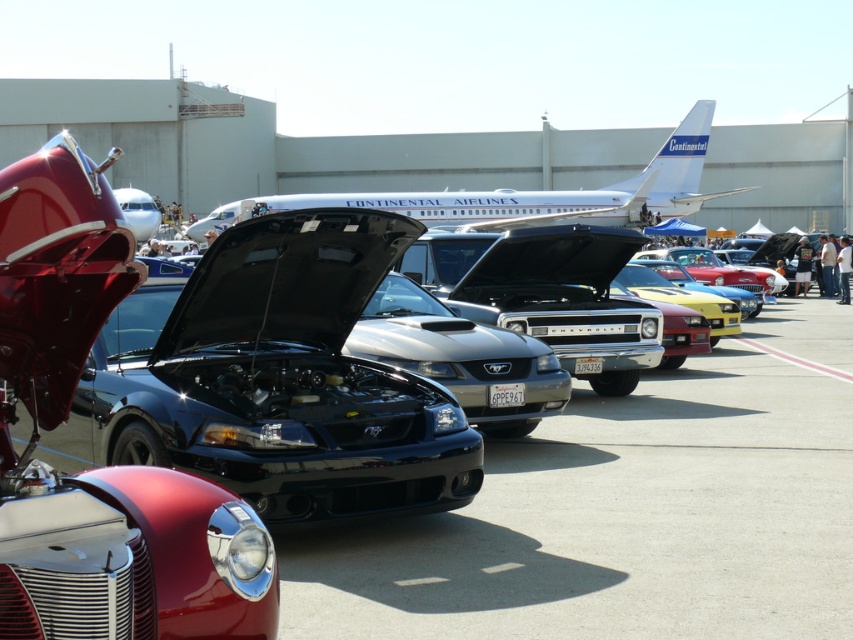
Consider the image. You are attending an outdoor car show at an airport where a large airplane is present. You notice two items of interest in the scene described. One is the shiny chrome car at left and the other is the white glossy airplane at upper center. From your vantage point, which object is positioned higher in the image?

The white glossy airplane at upper center is positioned higher than the shiny chrome car at left, as it is located at the upper center of the image while the car is on the lower left.

Based on the photo, you are a photographer trying to capture both the shiny chrome car at left and the white glossy airplane at upper center in a single frame. Based on their sizes, which object would appear narrower in the photo?

The shiny chrome car at left is thinner than the white glossy airplane at upper center, so it would appear narrower in the photo.